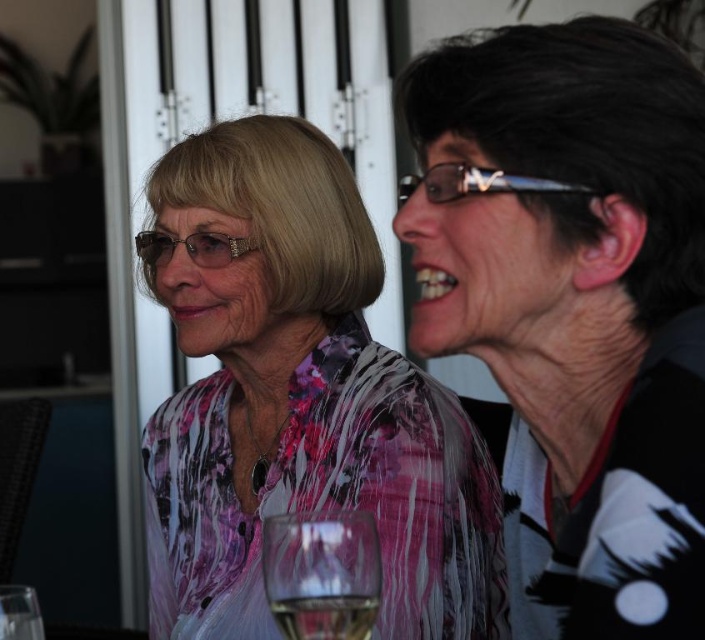
Does transparent glass at lower center appear on the left side of clear glass at lower center?

Yes, transparent glass at lower center is to the left of clear glass at lower center.

How distant is transparent glass at lower center from clear glass at lower center?

They are 0.56 inches apart.

Find the location of a particular element. The image size is (705, 640). transparent glass at lower center is located at coordinates (321, 573).

Can you confirm if black glossy hair at upper right is wider than clear plastic glasses at upper center?

Yes.

Does black glossy hair at upper right have a larger size compared to clear plastic glasses at upper center?

Yes.

Measure the distance between black glossy hair at upper right and camera.

The distance of black glossy hair at upper right from camera is 24.07 inches.

Find the location of a particular element. black glossy hair at upper right is located at coordinates (572, 307).

Locate an element on the screen. The image size is (705, 640). pink floral shirt at center is located at coordinates (300, 403).

Can you confirm if pink floral shirt at center is positioned above clear glass at lower center?

Yes, pink floral shirt at center is above clear glass at lower center.

Identify the location of pink floral shirt at center. [300, 403].